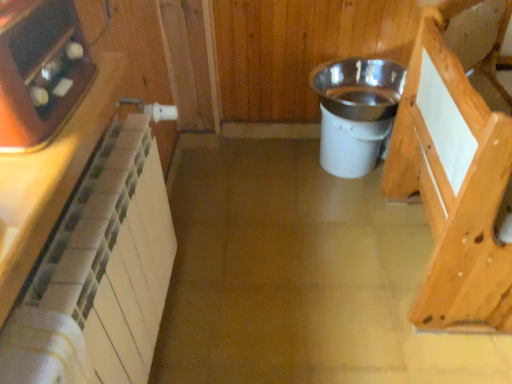
Question: Is point (457, 115) positioned closer to the camera than point (77, 173)?

Choices:
 (A) farther
 (B) closer

Answer: (A)

Question: Is light brown wood at right, which ranks as the second cabinetry in left-to-right order, inside or outside of white tile cabinetry at left, which ranks as the second cabinetry in back-to-front order?

Choices:
 (A) outside
 (B) inside

Answer: (A)

Question: Which object is the closest to the white tile cabinetry at left, which ranks as the first cabinetry in left-to-right order?

Choices:
 (A) white plastic bucket at center, marked as the 1th appliance in a right-to-left arrangement
 (B) matte black tray at upper left, the 2th appliance from the right
 (C) light brown wood at right, acting as the 2th cabinetry starting from the front

Answer: (B)

Question: Which is nearer to the white tile cabinetry at left, placed as the 1th cabinetry when sorted from front to back?

Choices:
 (A) white plastic bucket at center, which is counted as the 1th appliance, starting from the back
 (B) light brown wood at right, which ranks as the second cabinetry in left-to-right order
 (C) matte black tray at upper left, the 2th appliance from the right

Answer: (C)